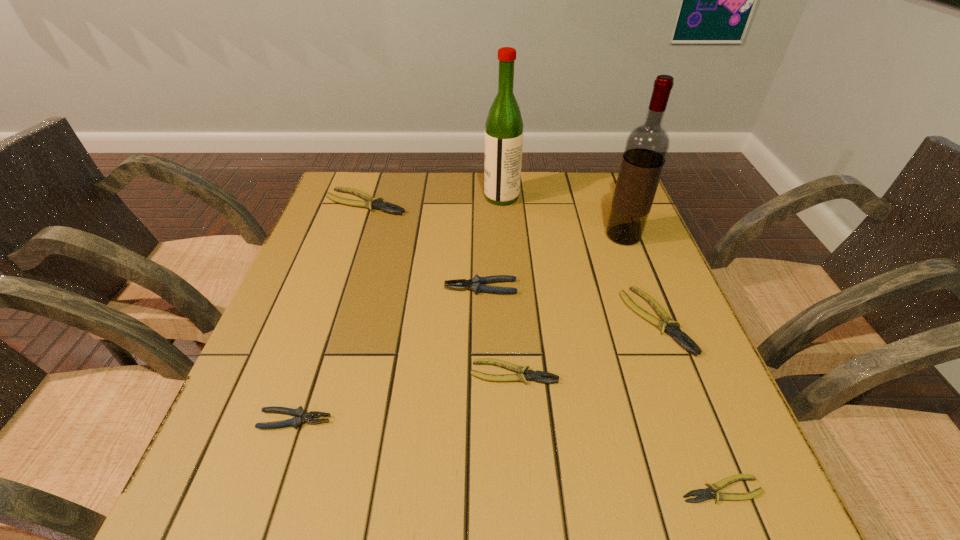
The image size is (960, 540). What are the coordinates of `object that is at the near right corner` in the screenshot? It's located at (705, 494).

Locate an element on the screen. This screenshot has width=960, height=540. vacant space at the far edge of the desktop is located at coordinates (574, 190).

Locate an element on the screen. The height and width of the screenshot is (540, 960). free spot at the near edge of the desktop is located at coordinates (488, 479).

Identify the location of vacant position at the left edge of the desktop. (315, 432).

In order to click on blank space at the right edge in this screenshot , I will do `click(594, 232)`.

Locate an element on the screen. vacant space at the far left corner of the desktop is located at coordinates (375, 190).

The height and width of the screenshot is (540, 960). In the image, there is a desktop. Find the location of `free space at the far right corner`. free space at the far right corner is located at coordinates (590, 201).

In the image, there is a desktop. Identify the location of vacant space at the near right corner. (745, 491).

At what (x,y) coordinates should I click in order to perform the action: click on free point between the farther gray pliers and the green liquor. Please return your answer as a coordinate pair (x, y). The width and height of the screenshot is (960, 540). Looking at the image, I should click on (492, 242).

Locate an element on the screen. free space between the third nearest pliers and the leftmost yellow pliers is located at coordinates (440, 288).